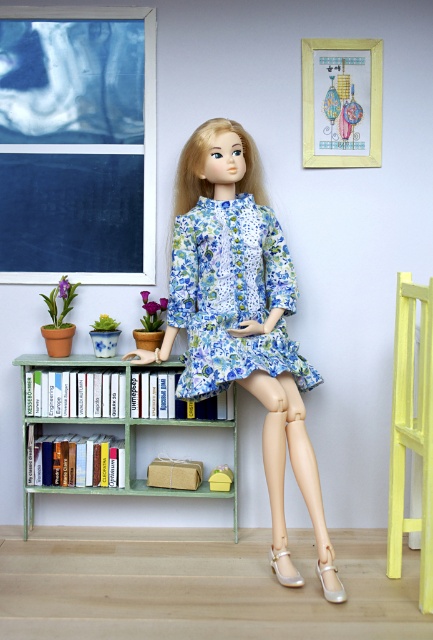
Question: Can you confirm if yellow painted wood chair at right is wider than wooden frame at upper center?

Choices:
 (A) yes
 (B) no

Answer: (B)

Question: Which is nearer to the yellow painted wood chair at right?

Choices:
 (A) wooden frame at upper center
 (B) floral fabric dress at center
 (C) green painted wood bookshelf at lower center

Answer: (B)

Question: Is floral fabric dress at center positioned in front of floral-patterned fabric dress at center?

Choices:
 (A) yes
 (B) no

Answer: (A)

Question: Which of the following is the farthest from the observer?

Choices:
 (A) (223, 262)
 (B) (427, 397)
 (C) (301, 364)
 (D) (329, 161)

Answer: (D)

Question: Which point is farther from the camera taking this photo?

Choices:
 (A) (313, 64)
 (B) (64, 438)

Answer: (A)

Question: Does floral fabric dress at center have a greater width compared to wooden bookshelf at lower left?

Choices:
 (A) no
 (B) yes

Answer: (B)